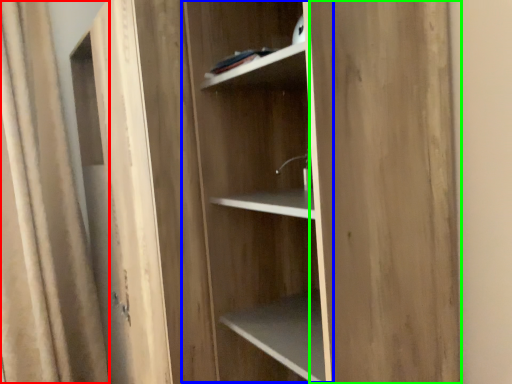
Question: Which is nearer to the curtain (highlighted by a red box)? cabinetry (highlighted by a blue box) or plywood (highlighted by a green box).

Choices:
 (A) cabinetry
 (B) plywood

Answer: (A)